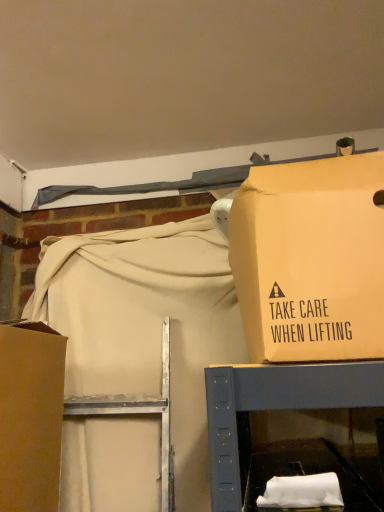
You are a GUI agent. You are given a task and a screenshot of the screen. Output one action in this format:
    pyautogui.click(x=<x>, y=<y>)
    Task: Click on the brown cardboard box at left, the second box from the right
    The width and height of the screenshot is (384, 512).
    Given the screenshot: What is the action you would take?
    pyautogui.click(x=30, y=416)

What do you see at coordinates (30, 416) in the screenshot? The width and height of the screenshot is (384, 512). I see `brown cardboard box at left, which appears as the first box when viewed from the left` at bounding box center [30, 416].

The image size is (384, 512). In order to click on matte cardboard box at upper right, which is counted as the 1th box, starting from the right in this screenshot , I will do `click(311, 259)`.

Describe the element at coordinates (311, 259) in the screenshot. I see `matte cardboard box at upper right, which is counted as the 1th box, starting from the right` at that location.

Locate an element on the screen. This screenshot has width=384, height=512. brown cardboard box at left, the second box from the right is located at coordinates (30, 416).

Would you say brown cardboard box at left, which appears as the first box when viewed from the left, is to the left or to the right of matte cardboard box at upper right, which is counted as the 1th box, starting from the right, in the picture?

Based on their positions, brown cardboard box at left, which appears as the first box when viewed from the left, is located to the left of matte cardboard box at upper right, which is counted as the 1th box, starting from the right.

Considering the positions of objects brown cardboard box at left, the second box from the right, and matte cardboard box at upper right, which is counted as the 1th box, starting from the right, in the image provided, who is in front, brown cardboard box at left, the second box from the right, or matte cardboard box at upper right, which is counted as the 1th box, starting from the right,?

matte cardboard box at upper right, which is counted as the 1th box, starting from the right, is closer to the camera.

Which is in front, point (6, 497) or point (329, 308)?

The point (329, 308) is closer to the camera.

From the image's perspective, is brown cardboard box at left, the second box from the right, located above matte cardboard box at upper right, which ranks as the second box in left-to-right order?

No.

From a real-world perspective, who is located higher, brown cardboard box at left, which appears as the first box when viewed from the left, or matte cardboard box at upper right, which is counted as the 1th box, starting from the right?

From a 3D spatial view, matte cardboard box at upper right, which is counted as the 1th box, starting from the right, is above.

Considering the sizes of brown cardboard box at left, which appears as the first box when viewed from the left, and matte cardboard box at upper right, which is counted as the 1th box, starting from the right, in the image, is brown cardboard box at left, which appears as the first box when viewed from the left, wider or thinner than matte cardboard box at upper right, which is counted as the 1th box, starting from the right,?

In the image, brown cardboard box at left, which appears as the first box when viewed from the left, appears to be more narrow than matte cardboard box at upper right, which is counted as the 1th box, starting from the right.

Which of these two, brown cardboard box at left, which appears as the first box when viewed from the left, or matte cardboard box at upper right, which ranks as the second box in left-to-right order, stands taller?

brown cardboard box at left, which appears as the first box when viewed from the left.

Between brown cardboard box at left, the second box from the right, and matte cardboard box at upper right, which is counted as the 1th box, starting from the right, which one has larger size?

matte cardboard box at upper right, which is counted as the 1th box, starting from the right.

Would you say brown cardboard box at left, the second box from the right, is outside matte cardboard box at upper right, which ranks as the second box in left-to-right order?

Absolutely, brown cardboard box at left, the second box from the right, is external to matte cardboard box at upper right, which ranks as the second box in left-to-right order.

Consider the image. Are brown cardboard box at left, the second box from the right, and matte cardboard box at upper right, which is counted as the 1th box, starting from the right, located far from each other?

That's not correct — brown cardboard box at left, the second box from the right, is a little close to matte cardboard box at upper right, which is counted as the 1th box, starting from the right.

Does brown cardboard box at left, the second box from the right, turn towards matte cardboard box at upper right, which ranks as the second box in left-to-right order?

Yes, brown cardboard box at left, the second box from the right, is turned towards matte cardboard box at upper right, which ranks as the second box in left-to-right order.

How different are the orientations of brown cardboard box at left, the second box from the right, and matte cardboard box at upper right, which ranks as the second box in left-to-right order, in degrees?

The angle between the facing direction of brown cardboard box at left, the second box from the right, and the facing direction of matte cardboard box at upper right, which ranks as the second box in left-to-right order, is 90.5 degrees.

How distant is brown cardboard box at left, the second box from the right, from matte cardboard box at upper right, which is counted as the 1th box, starting from the right?

The distance of brown cardboard box at left, the second box from the right, from matte cardboard box at upper right, which is counted as the 1th box, starting from the right, is 49.69 centimeters.

At what (x,y) coordinates should I click in order to perform the action: click on box above the brown cardboard box at left, which appears as the first box when viewed from the left (from the image's perspective). Please return your answer as a coordinate pair (x, y). This screenshot has height=512, width=384. Looking at the image, I should click on (311, 259).

Which is more to the right, matte cardboard box at upper right, which is counted as the 1th box, starting from the right, or brown cardboard box at left, the second box from the right?

matte cardboard box at upper right, which is counted as the 1th box, starting from the right.

Which is in front, matte cardboard box at upper right, which ranks as the second box in left-to-right order, or brown cardboard box at left, which appears as the first box when viewed from the left?

Positioned in front is matte cardboard box at upper right, which ranks as the second box in left-to-right order.

Is point (302, 325) closer or farther from the camera than point (52, 465)?

Clearly, point (302, 325) is closer to the camera than point (52, 465).

From the image's perspective, is matte cardboard box at upper right, which ranks as the second box in left-to-right order, located above or below brown cardboard box at left, which appears as the first box when viewed from the left?

Based on their image positions, matte cardboard box at upper right, which ranks as the second box in left-to-right order, is located above brown cardboard box at left, which appears as the first box when viewed from the left.

From a real-world perspective, who is located higher, matte cardboard box at upper right, which ranks as the second box in left-to-right order, or brown cardboard box at left, which appears as the first box when viewed from the left?

In real-world perspective, matte cardboard box at upper right, which ranks as the second box in left-to-right order, is above.

Which of these two, matte cardboard box at upper right, which is counted as the 1th box, starting from the right, or brown cardboard box at left, the second box from the right, is thinner?

brown cardboard box at left, the second box from the right, is thinner.

Is matte cardboard box at upper right, which ranks as the second box in left-to-right order, taller or shorter than brown cardboard box at left, the second box from the right?

Clearly, matte cardboard box at upper right, which ranks as the second box in left-to-right order, is shorter compared to brown cardboard box at left, the second box from the right.

In terms of size, does matte cardboard box at upper right, which ranks as the second box in left-to-right order, appear bigger or smaller than brown cardboard box at left, the second box from the right?

In the image, matte cardboard box at upper right, which ranks as the second box in left-to-right order, appears to be larger than brown cardboard box at left, the second box from the right.

Is brown cardboard box at left, the second box from the right, completely or partially inside matte cardboard box at upper right, which ranks as the second box in left-to-right order?

Actually, brown cardboard box at left, the second box from the right, is outside matte cardboard box at upper right, which ranks as the second box in left-to-right order.

Is matte cardboard box at upper right, which is counted as the 1th box, starting from the right, far away from brown cardboard box at left, the second box from the right?

No, matte cardboard box at upper right, which is counted as the 1th box, starting from the right, is not far from brown cardboard box at left, the second box from the right.

Is brown cardboard box at left, the second box from the right, at the back of matte cardboard box at upper right, which ranks as the second box in left-to-right order?

No.

What's the angular difference between matte cardboard box at upper right, which is counted as the 1th box, starting from the right, and brown cardboard box at left, which appears as the first box when viewed from the left,'s facing directions?

The angular difference between matte cardboard box at upper right, which is counted as the 1th box, starting from the right, and brown cardboard box at left, which appears as the first box when viewed from the left, is 90.5 degrees.

Locate an element on the screen. box located in front of the brown cardboard box at left, the second box from the right is located at coordinates (311, 259).

Where is `box on the right of brown cardboard box at left, which appears as the first box when viewed from the left`? The height and width of the screenshot is (512, 384). box on the right of brown cardboard box at left, which appears as the first box when viewed from the left is located at coordinates (311, 259).

The height and width of the screenshot is (512, 384). In order to click on box below the matte cardboard box at upper right, which ranks as the second box in left-to-right order (from the image's perspective) in this screenshot , I will do `click(30, 416)`.